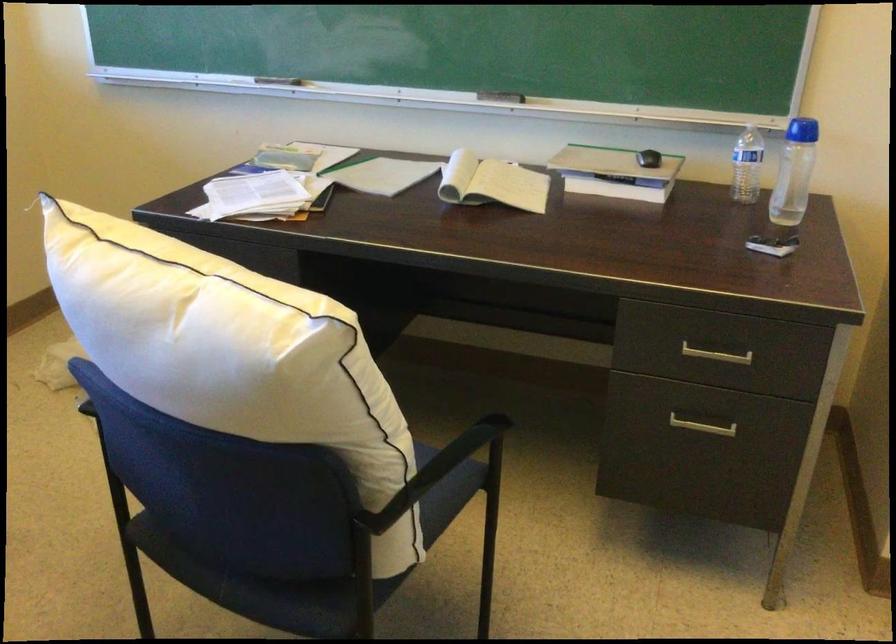
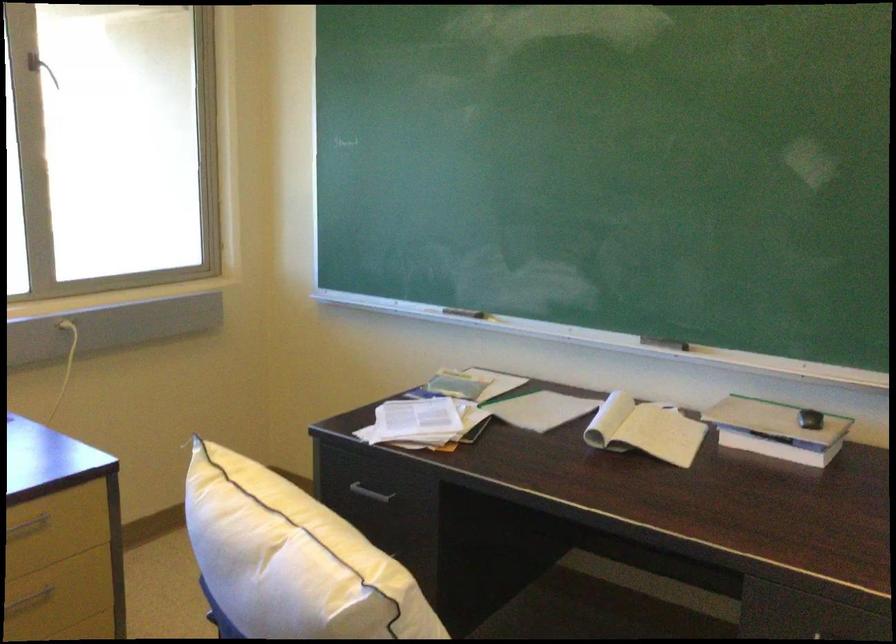
Where in the second image is the point corresponding to (495,187) from the first image?

(644, 430)